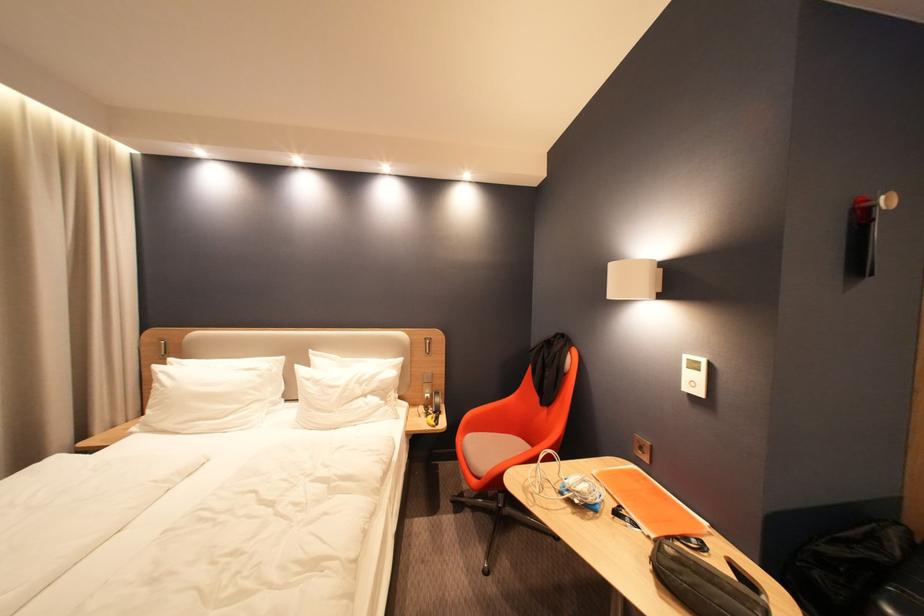
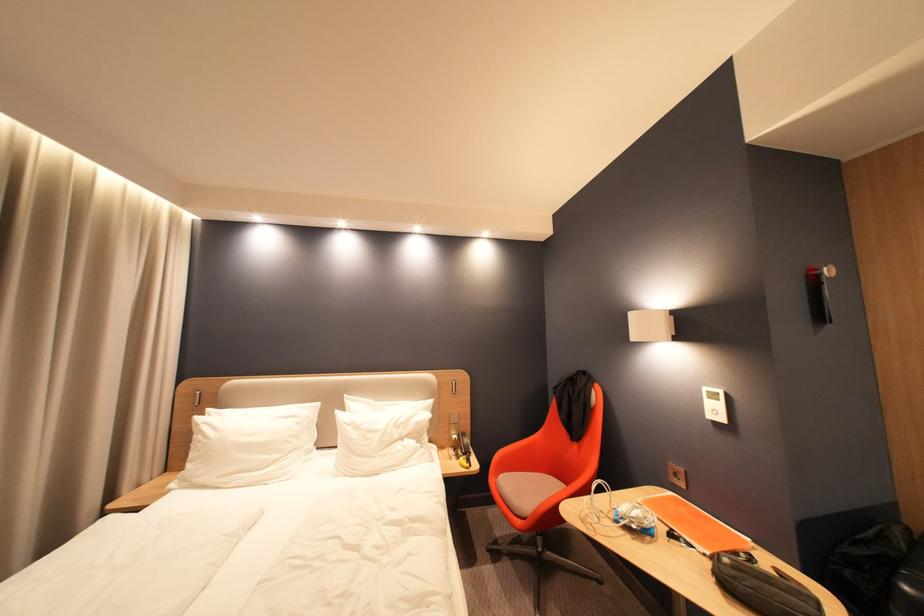
Question: I am providing you with two images of the same scene from different viewpoints. After the viewpoint changes to image2, which objects are now occluded?

Choices:
 (A) orange folder
 (B) orange chair armrest
 (C) power outlet
 (D) none of these

Answer: (D)